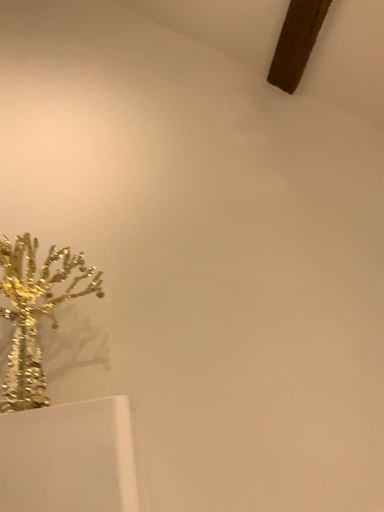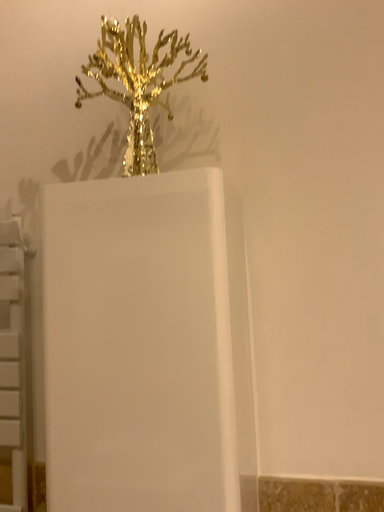
Question: Which way did the camera rotate in the video?

Choices:
 (A) rotated left
 (B) rotated right

Answer: (A)